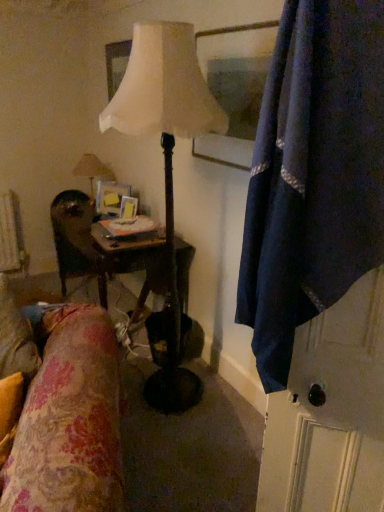
Question: In terms of width, does matte white lamp at center, positioned as the 2th lamp in left-to-right order, look wider or thinner when compared to floral fabric at lower left?

Choices:
 (A) wide
 (B) thin

Answer: (B)

Question: Visually, is matte white lamp at center, marked as the 1th lamp in a right-to-left arrangement, positioned to the left or to the right of floral fabric at lower left?

Choices:
 (A) right
 (B) left

Answer: (A)

Question: Considering the real-world distances, which object is farthest from the matte white lamp at center, acting as the second lamp starting from the back?

Choices:
 (A) navy blue fabric at right
 (B) matte beige lamp at upper left, which is the first lamp from back to front
 (C) floral fabric at lower left
 (D) wooden glossy picture frame at center
 (E) wooden chair at left

Answer: (B)

Question: Which is nearer to the navy blue fabric at right?

Choices:
 (A) wooden glossy picture frame at center
 (B) matte beige lamp at upper left, which is the 1th lamp in left-to-right order
 (C) matte white lamp at center, positioned as the 2th lamp in left-to-right order
 (D) wooden chair at left
 (E) floral fabric at lower left

Answer: (E)